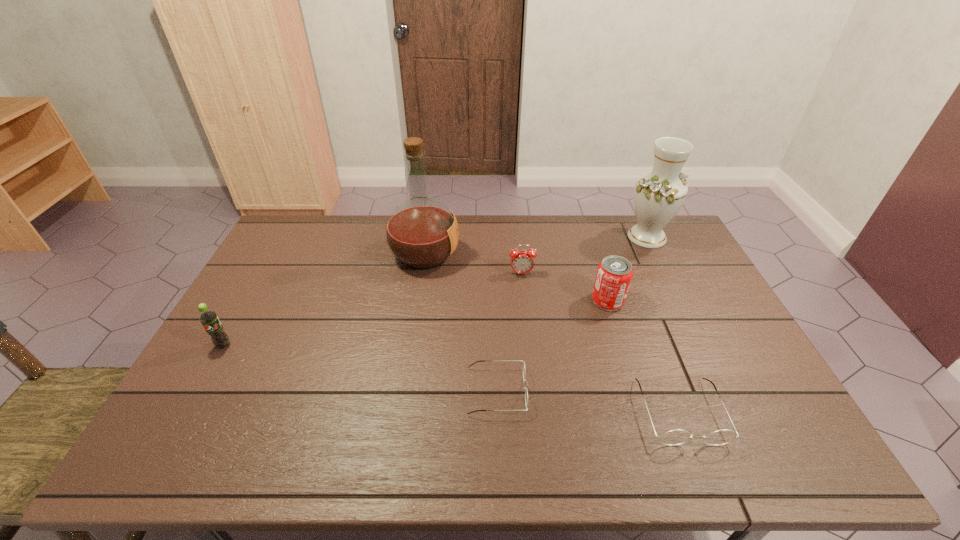
This screenshot has width=960, height=540. I want to click on vase that is at the right edge, so click(x=658, y=196).

Locate an element on the screen. Image resolution: width=960 pixels, height=540 pixels. object that is at the far right corner is located at coordinates (x=658, y=196).

Locate an element on the screen. The width and height of the screenshot is (960, 540). object present at the near right corner is located at coordinates (676, 437).

I want to click on vacant region at the far edge of the desktop, so click(x=492, y=245).

The width and height of the screenshot is (960, 540). Identify the location of vacant space at the left edge of the desktop. (298, 256).

Locate an element on the screen. Image resolution: width=960 pixels, height=540 pixels. free space at the right edge is located at coordinates (654, 268).

Image resolution: width=960 pixels, height=540 pixels. Identify the location of vacant space at the near right corner. (751, 409).

I want to click on free space between the liquor and the leftmost object, so click(324, 300).

Identify the location of free area in between the fourth farthest object and the soda. This screenshot has height=540, width=960. (416, 323).

Locate an element on the screen. This screenshot has width=960, height=540. vacant space that's between the leftmost object and the shorter spectacles is located at coordinates (360, 368).